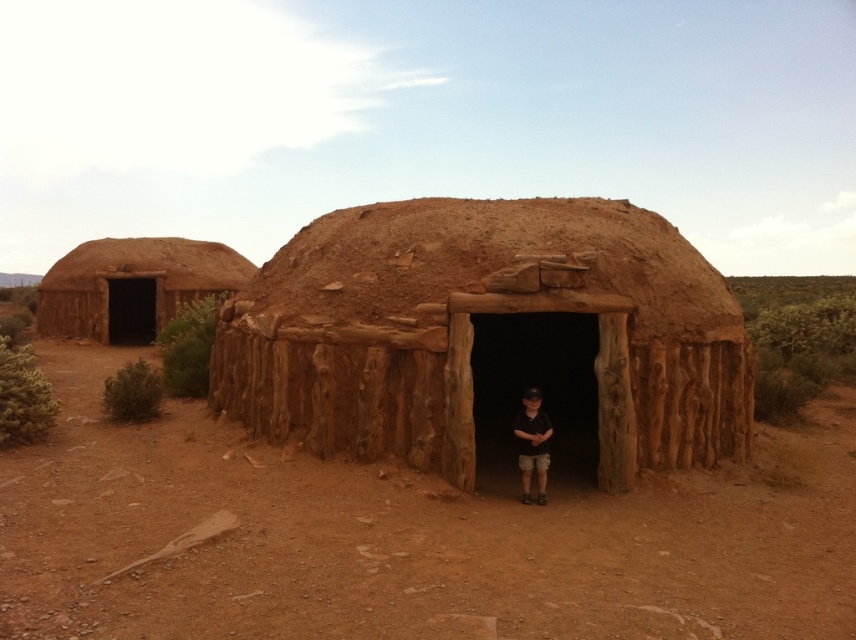
Question: From the image, what is the correct spatial relationship of brown mud hut at center in relation to brown mud hut at left?

Choices:
 (A) right
 (B) left

Answer: (A)

Question: Which is nearer to the brown mud hut at left?

Choices:
 (A) black cotton shirt at center
 (B) brown mud hut at center

Answer: (B)

Question: Is brown mud hut at left to the left of black cotton shirt at center from the viewer's perspective?

Choices:
 (A) yes
 (B) no

Answer: (A)

Question: Observing the image, what is the correct spatial positioning of brown mud hut at left in reference to black cotton shirt at center?

Choices:
 (A) above
 (B) below

Answer: (A)

Question: Which point is farther to the camera?

Choices:
 (A) black cotton shirt at center
 (B) brown mud hut at center
 (C) brown mud hut at left

Answer: (C)

Question: Considering the real-world distances, which object is farthest from the brown mud hut at center?

Choices:
 (A) black cotton shirt at center
 (B) brown mud hut at left

Answer: (B)